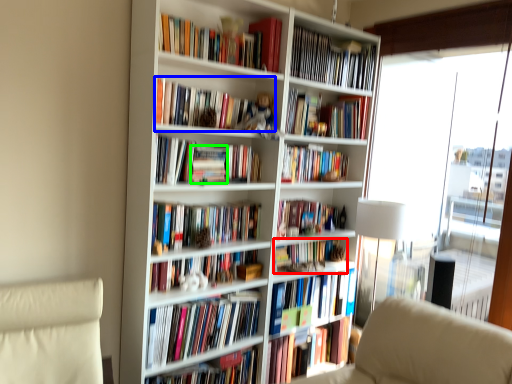
Question: Which object is the farthest from book (highlighted by a red box)? Choose among these: book (highlighted by a blue box) or paperback book (highlighted by a green box).

Choices:
 (A) book
 (B) paperback book

Answer: (A)